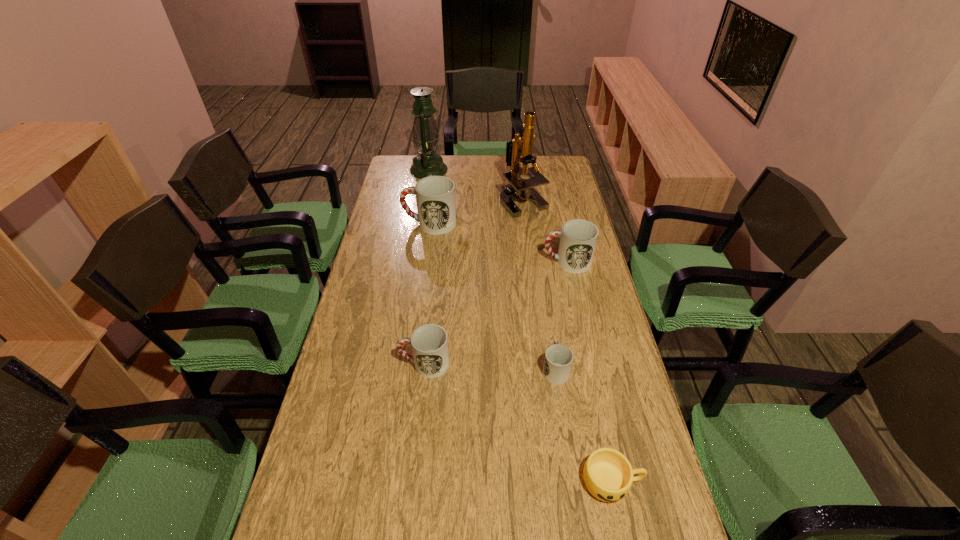
You are a GUI agent. You are given a task and a screenshot of the screen. Output one action in this format:
    pyautogui.click(x=<x>, y=<y>)
    Task: Click on the vacant space located 0.170m on the side of the fifth tallest object where the handle is located
    This screenshot has width=960, height=540.
    Given the screenshot: What is the action you would take?
    pyautogui.click(x=342, y=363)

You are a GUI agent. You are given a task and a screenshot of the screen. Output one action in this format:
    pyautogui.click(x=<x>, y=<y>)
    Task: Click on the vacant region located on the side of the sixth tallest object where the handle is located
    Image resolution: width=960 pixels, height=540 pixels.
    Given the screenshot: What is the action you would take?
    pyautogui.click(x=540, y=265)

What are the coordinates of `vacant region located on the side of the sixth tallest object where the handle is located` in the screenshot? It's located at (545, 303).

The height and width of the screenshot is (540, 960). What are the coordinates of `free spot located 0.250m on the side of the sixth tallest object where the handle is located` in the screenshot? It's located at (544, 294).

Where is `vacant space located on the left of the nearest object`? This screenshot has width=960, height=540. vacant space located on the left of the nearest object is located at coordinates (412, 482).

Where is `object situated at the far edge`? object situated at the far edge is located at coordinates (425, 135).

Where is `oil lamp at the left edge`? The height and width of the screenshot is (540, 960). oil lamp at the left edge is located at coordinates (425, 135).

Locate an element on the screen. This screenshot has width=960, height=540. cup present at the left edge is located at coordinates (435, 195).

Where is `microscope at the right edge`? microscope at the right edge is located at coordinates (523, 188).

What are the coordinates of `object that is at the far left corner` in the screenshot? It's located at (425, 135).